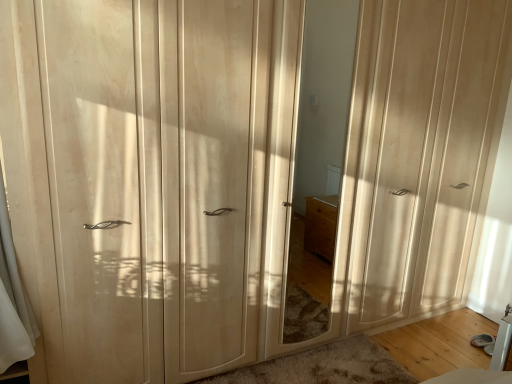
Question: From the image's perspective, is matte wood wardrobe at left, marked as the first screen door in a left-to-right arrangement, above or below matte wood mirror at center?

Choices:
 (A) above
 (B) below

Answer: (B)

Question: Considering the relative positions of matte wood wardrobe at left, which ranks as the 2th screen door in right-to-left order, and matte wood mirror at center in the image provided, is matte wood wardrobe at left, which ranks as the 2th screen door in right-to-left order, to the left or to the right of matte wood mirror at center?

Choices:
 (A) left
 (B) right

Answer: (A)

Question: Which object is the closest to the matte wood mirror at center?

Choices:
 (A) matte wood wardrobe at right, acting as the first screen door starting from the right
 (B) matte wood wardrobe at left, marked as the first screen door in a left-to-right arrangement

Answer: (A)

Question: Which of these objects is positioned farthest from the matte wood wardrobe at left, marked as the first screen door in a left-to-right arrangement?

Choices:
 (A) matte wood mirror at center
 (B) matte wood wardrobe at right, acting as the first screen door starting from the right

Answer: (B)